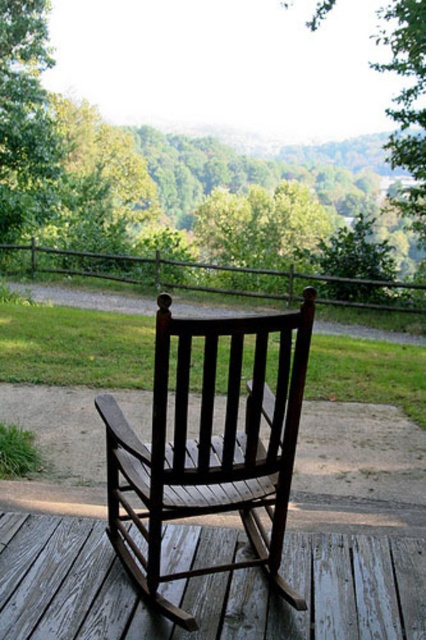
Which is more to the right, dark brown wood rocking chair at center or green leafy tree at upper left?

dark brown wood rocking chair at center is more to the right.

Between dark brown wood rocking chair at center and green leafy tree at upper left, which one is positioned lower?

Positioned lower is dark brown wood rocking chair at center.

Locate an element on the screen. The height and width of the screenshot is (640, 426). dark brown wood rocking chair at center is located at coordinates tap(210, 448).

Locate an element on the screen. This screenshot has width=426, height=640. wooden deck at center is located at coordinates (207, 588).

Does point (23, 518) come farther from viewer compared to point (25, 125)?

No.

Is point (0, 579) in front of point (0, 80)?

Yes.

At what (x,y) coordinates should I click in order to perform the action: click on wooden deck at center. Please return your answer as a coordinate pair (x, y). Looking at the image, I should click on (207, 588).

Does green leafy tree at upper center have a lesser height compared to wooden deck at center?

No.

Describe the element at coordinates (169, 212) in the screenshot. The image size is (426, 640). I see `green leafy tree at upper center` at that location.

Is point (126, 182) more distant than point (362, 595)?

Yes, it is.

The height and width of the screenshot is (640, 426). Find the location of `green leafy tree at upper center`. green leafy tree at upper center is located at coordinates (169, 212).